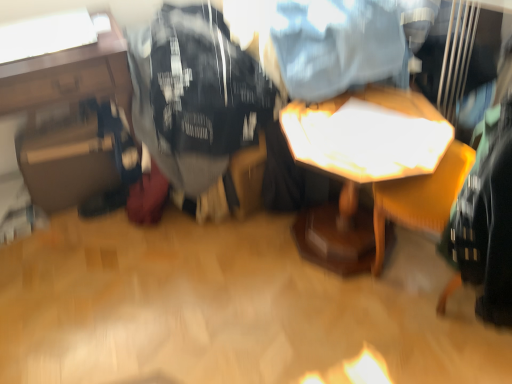
Question: In terms of width, does black cotton t-shirt at center look wider or thinner when compared to wooden table at center, the second table in the left-to-right sequence?

Choices:
 (A) wide
 (B) thin

Answer: (A)

Question: Is point (272, 97) closer or farther from the camera than point (433, 109)?

Choices:
 (A) closer
 (B) farther

Answer: (A)

Question: Based on their relative distances, which object is farther from the black cotton t-shirt at center?

Choices:
 (A) matte black suitcase at left, which is the 1th table in left-to-right order
 (B) wooden table at center, the second table in the left-to-right sequence

Answer: (B)

Question: Which is nearer to the black cotton t-shirt at center?

Choices:
 (A) wooden table at center, the second table in the left-to-right sequence
 (B) matte black suitcase at left, which is the 1th table in left-to-right order

Answer: (B)